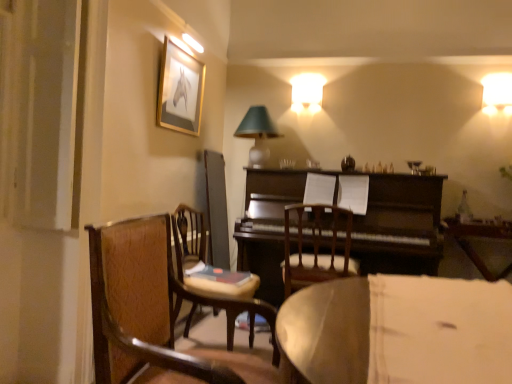
The width and height of the screenshot is (512, 384). What do you see at coordinates (157, 313) in the screenshot? I see `wooden chair at left, the third chair when ordered from back to front` at bounding box center [157, 313].

The image size is (512, 384). What do you see at coordinates (180, 90) in the screenshot? I see `gold-framed picture at upper left` at bounding box center [180, 90].

Identify the location of gold-framed picture at upper left. (180, 90).

Image resolution: width=512 pixels, height=384 pixels. Describe the element at coordinates (257, 134) in the screenshot. I see `matte glass table lamp at upper center` at that location.

Where is `dark brown polished wood piano at center`? dark brown polished wood piano at center is located at coordinates (400, 225).

Describe the element at coordinates (400, 225) in the screenshot. The width and height of the screenshot is (512, 384). I see `dark brown polished wood piano at center` at that location.

Locate an element on the screen. wooden table at center is located at coordinates (478, 237).

You are a GUI agent. You are given a task and a screenshot of the screen. Output one action in this format:
    pyautogui.click(x=<x>, y=<y>)
    Task: Click on the wooden chair at center, which is the second chair from back to front
    
    Given the screenshot: What is the action you would take?
    pyautogui.click(x=187, y=238)

From the image's perspective, who appears lower, wooden chair at left, which is counted as the 1th chair, starting from the front, or dark brown polished wood piano at center?

wooden chair at left, which is counted as the 1th chair, starting from the front, is shown below in the image.

From a real-world perspective, who is located lower, wooden chair at left, the third chair when ordered from back to front, or dark brown polished wood piano at center?

dark brown polished wood piano at center is physically lower.

Is wooden chair at left, the third chair when ordered from back to front, thinner than dark brown polished wood piano at center?

Indeed, wooden chair at left, the third chair when ordered from back to front, has a lesser width compared to dark brown polished wood piano at center.

In terms of size, does wooden chair at left, which is counted as the 1th chair, starting from the front, appear bigger or smaller than dark brown polished wood piano at center?

wooden chair at left, which is counted as the 1th chair, starting from the front, is smaller than dark brown polished wood piano at center.

From the image's perspective, is wooden chair at left, which is counted as the 1th chair, starting from the front, located above wooden chair at center, the 2th chair viewed from the front?

Indeed, from the image's perspective, wooden chair at left, which is counted as the 1th chair, starting from the front, is shown above wooden chair at center, the 2th chair viewed from the front.

In terms of size, does wooden chair at left, which is counted as the 1th chair, starting from the front, appear bigger or smaller than wooden chair at center, the 2th chair viewed from the front?

In the image, wooden chair at left, which is counted as the 1th chair, starting from the front, appears to be smaller than wooden chair at center, the 2th chair viewed from the front.

Consider the image. Which object is wider, wooden chair at left, the third chair when ordered from back to front, or wooden chair at center, which is the second chair from back to front?

wooden chair at left, the third chair when ordered from back to front, is wider.

Which object is closer to the camera, wooden chair at left, the third chair when ordered from back to front, or wooden chair at center, the 2th chair viewed from the front?

wooden chair at left, the third chair when ordered from back to front, is closer to the camera.

Considering the positions of objects wooden chair at left, the third chair when ordered from back to front, and wooden table at center in the image provided, who is behind, wooden chair at left, the third chair when ordered from back to front, or wooden table at center?

Positioned behind is wooden table at center.

Which is correct: wooden chair at left, the third chair when ordered from back to front, is inside wooden table at center, or outside of it?

wooden chair at left, the third chair when ordered from back to front, cannot be found inside wooden table at center.

Can you tell me how much wooden chair at left, which is counted as the 1th chair, starting from the front, and wooden table at center differ in facing direction?

94 degrees.

Is dark brown polished wood piano at center aimed at wooden chair at center, which is the second chair from back to front?

Yes.

Considering the sizes of objects dark brown polished wood piano at center and wooden chair at center, the 2th chair viewed from the front, in the image provided, who is taller, dark brown polished wood piano at center or wooden chair at center, the 2th chair viewed from the front,?

Standing taller between the two is dark brown polished wood piano at center.

Does point (353, 247) appear closer or farther from the camera than point (184, 210)?

Point (353, 247) appears to be farther away from the viewer than point (184, 210).

How different are the orientations of dark brown polished wood piano at center and wooden chair at center, which is the second chair from back to front, in degrees?

The angular difference between dark brown polished wood piano at center and wooden chair at center, which is the second chair from back to front, is 88.4 degrees.

Is wooden chair at center, marked as the 3th chair in a front-to-back arrangement, directly adjacent to wooden table at center?

No, wooden chair at center, marked as the 3th chair in a front-to-back arrangement, is not next to wooden table at center.

Between point (341, 213) and point (509, 222), which one is positioned behind?

The point (509, 222) is farther.

Who is shorter, wooden chair at center, which is the first chair from back to front, or wooden table at center?

wooden table at center.

Is wooden chair at center, marked as the 3th chair in a front-to-back arrangement, positioned behind matte glass table lamp at upper center?

No, wooden chair at center, marked as the 3th chair in a front-to-back arrangement, is in front of matte glass table lamp at upper center.

Are wooden chair at center, which is the first chair from back to front, and matte glass table lamp at upper center beside each other?

wooden chair at center, which is the first chair from back to front, and matte glass table lamp at upper center are not in contact.

Is wooden chair at center, which is the first chair from back to front, to the left of matte glass table lamp at upper center from the viewer's perspective?

No, wooden chair at center, which is the first chair from back to front, is not to the left of matte glass table lamp at upper center.

Which is more to the left, matte glass table lamp at upper center or wooden chair at left, which is counted as the 1th chair, starting from the front?

From the viewer's perspective, wooden chair at left, which is counted as the 1th chair, starting from the front, appears more on the left side.

Considering the sizes of objects matte glass table lamp at upper center and wooden chair at left, the third chair when ordered from back to front, in the image provided, who is smaller, matte glass table lamp at upper center or wooden chair at left, the third chair when ordered from back to front,?

matte glass table lamp at upper center.

Does matte glass table lamp at upper center have a lesser width compared to wooden chair at left, the third chair when ordered from back to front?

Yes.

Which point is more forward, (257, 154) or (198, 357)?

Positioned in front is point (198, 357).

Find the location of a particular element. This screenshot has height=384, width=512. chair above the dark brown polished wood piano at center (from a real-world perspective) is located at coordinates (157, 313).

The image size is (512, 384). What are the coordinates of `the 1st chair to the right of the wooden chair at center, the 2th chair viewed from the front, counting from the anchor's position` in the screenshot? It's located at (157, 313).

Looking at the image, which one is located closer to gold-framed picture at upper left, matte glass table lamp at upper center or wooden chair at left, which is counted as the 1th chair, starting from the front?

matte glass table lamp at upper center is closer to gold-framed picture at upper left.

Which object lies nearer to the anchor point wooden chair at left, which is counted as the 1th chair, starting from the front, wooden table at center or matte glass table lamp at upper center?

matte glass table lamp at upper center.

Consider the image. When comparing their distances from wooden table at center, does dark brown polished wood piano at center or wooden chair at center, marked as the 3th chair in a front-to-back arrangement, seem further?

Based on the image, wooden chair at center, marked as the 3th chair in a front-to-back arrangement, appears to be further to wooden table at center.

Which object lies further to the anchor point wooden chair at center, which is the first chair from back to front, wooden chair at center, which is the second chair from back to front, or wooden chair at left, which is counted as the 1th chair, starting from the front?

Based on the image, wooden chair at left, which is counted as the 1th chair, starting from the front, appears to be further to wooden chair at center, which is the first chair from back to front.

When comparing their distances from gold-framed picture at upper left, does wooden chair at left, the third chair when ordered from back to front, or dark brown polished wood piano at center seem further?

Based on the image, wooden chair at left, the third chair when ordered from back to front, appears to be further to gold-framed picture at upper left.

Looking at the image, which one is located further to matte glass table lamp at upper center, gold-framed picture at upper left or dark brown polished wood piano at center?

Among the two, dark brown polished wood piano at center is located further to matte glass table lamp at upper center.

Looking at the image, which one is located closer to wooden chair at center, which is the second chair from back to front, wooden table at center or gold-framed picture at upper left?

gold-framed picture at upper left.

Based on their spatial positions, is wooden chair at left, the third chair when ordered from back to front, or dark brown polished wood piano at center further from wooden chair at center, which is the first chair from back to front?

wooden chair at left, the third chair when ordered from back to front, is further to wooden chair at center, which is the first chair from back to front.

Where is `piano between matte glass table lamp at upper center and wooden chair at center, which is the second chair from back to front, in the vertical direction`? piano between matte glass table lamp at upper center and wooden chair at center, which is the second chair from back to front, in the vertical direction is located at coordinates (400, 225).

Image resolution: width=512 pixels, height=384 pixels. Find the location of `table lamp between gold-framed picture at upper left and wooden chair at center, which is the first chair from back to front, from top to bottom`. table lamp between gold-framed picture at upper left and wooden chair at center, which is the first chair from back to front, from top to bottom is located at coordinates (257, 134).

I want to click on piano between gold-framed picture at upper left and wooden chair at center, which is the first chair from back to front, in the vertical direction, so click(400, 225).

Image resolution: width=512 pixels, height=384 pixels. What are the coordinates of `piano between wooden chair at center, marked as the 3th chair in a front-to-back arrangement, and wooden table at center` in the screenshot? It's located at (400, 225).